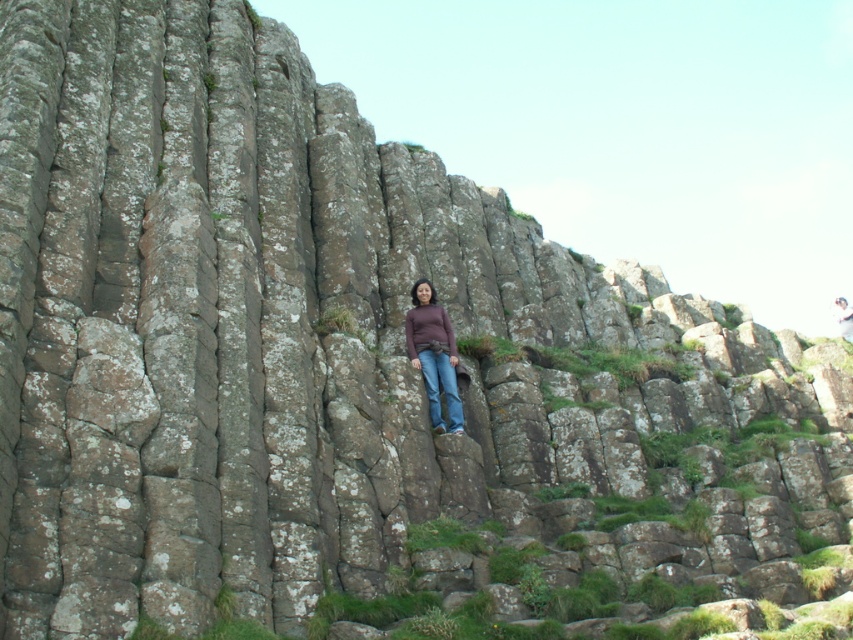
You are a photographer trying to capture a clear shot of the person standing on the rock columns. Since both the matte brown sweater at center and the matte brown hair at center are in focus, which one is positioned more to the left side of the photo?

The matte brown sweater at center is positioned to the left of the matte brown hair at center, so the sweater is more to the left side of the photo.

You are a photographer standing at the base of the rock formation. You notice two points marked in the image. Which point, point (444, 332) or point (839, 310), is closer to your position?

Point (444, 332) is closer to the camera than point (839, 310), so it is closer to your position.

You are a hiker who wants to take a photo of the rock formation. You notice the matte brown sweater at center and the matte brown hair at center in your viewfinder. Which object should you adjust your camera to focus on first if you want to capture the larger object in the scene?

The matte brown hair at center is larger than the matte brown sweater at center, so you should focus on the matte brown hair at center first to capture the larger object.